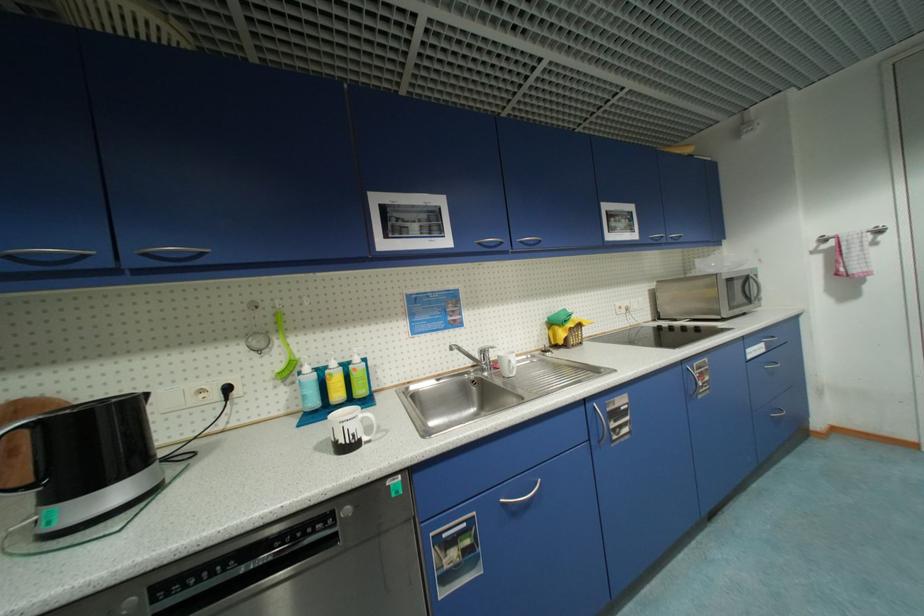
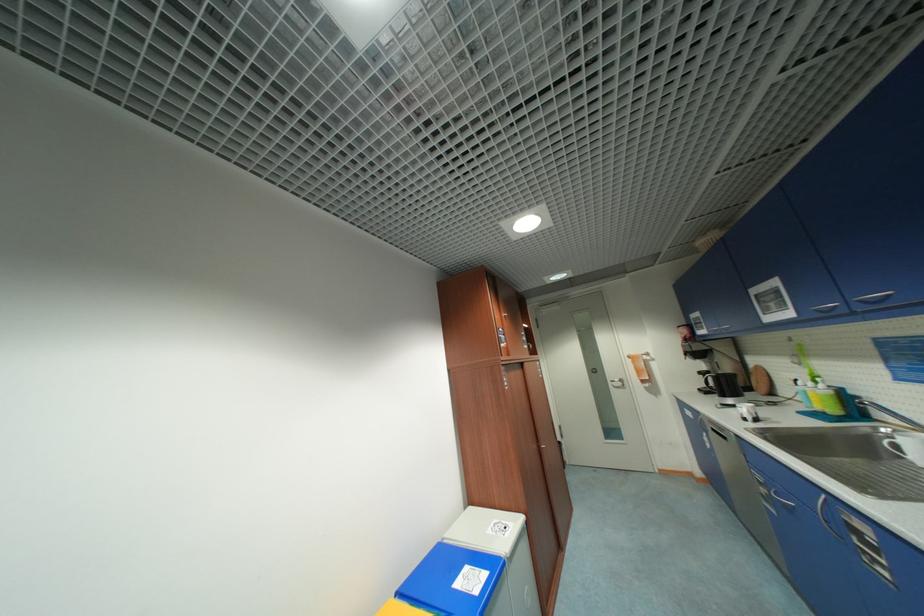
The point at (527, 244) is marked in the first image. Where is the corresponding point in the second image?

(867, 302)